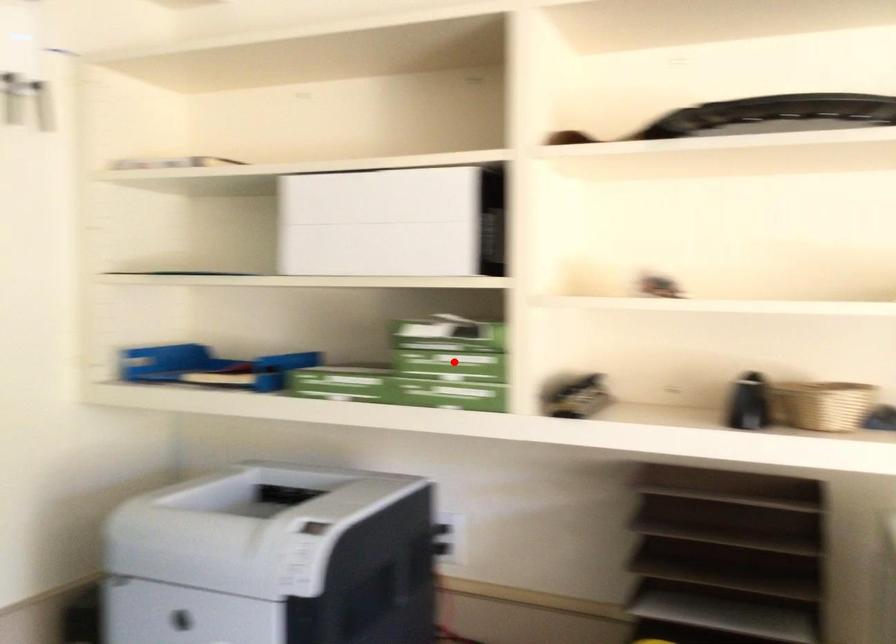
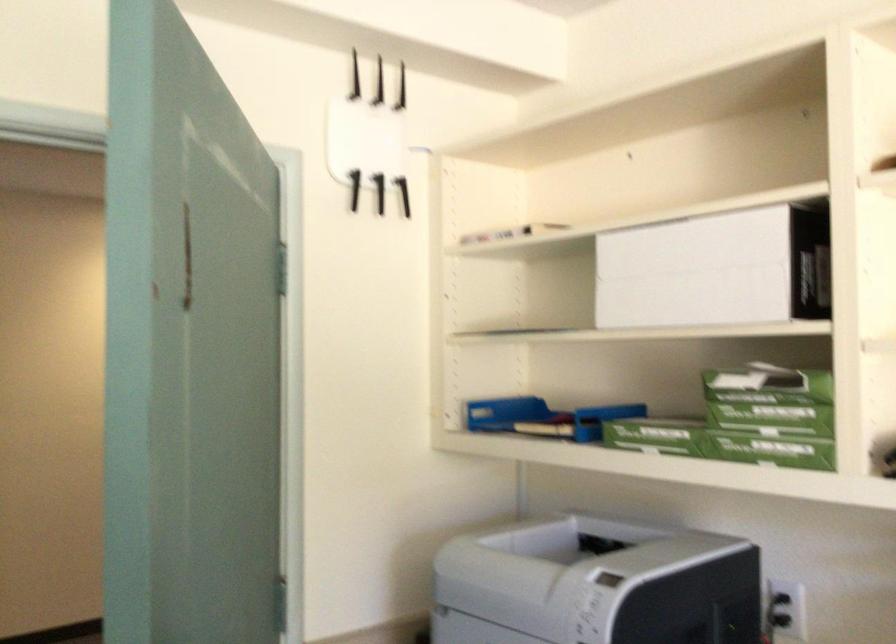
The point at the highlighted location is marked in the first image. Where is the corresponding point in the second image?

(769, 420)